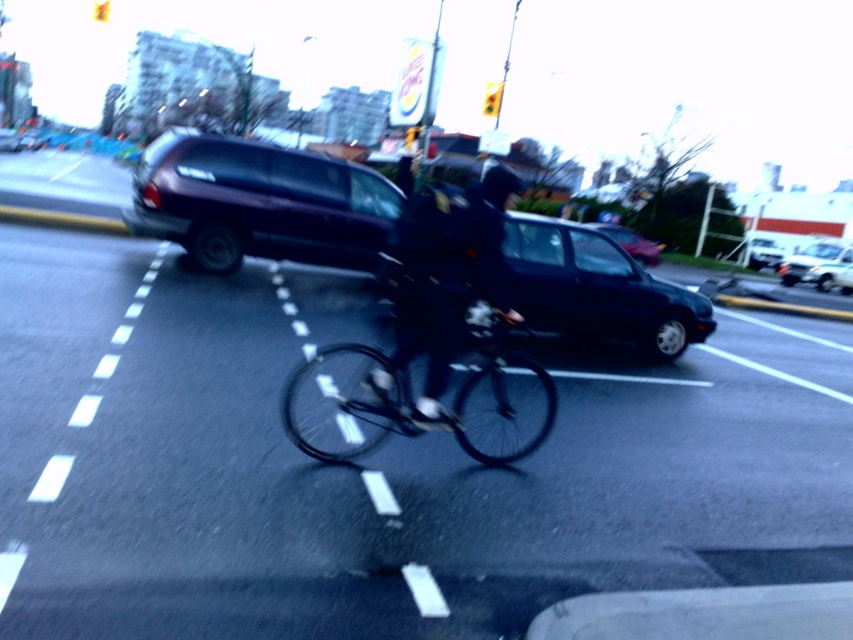
Describe the element at coordinates (259, 202) in the screenshot. This screenshot has height=640, width=853. I see `metallic purple suv at center` at that location.

Is metallic purple suv at center further to camera compared to white glossy suv at center?

No.

Who is more distant from viewer, (587, 282) or (810, 269)?

The point (810, 269) is more distant.

Where is `metallic purple suv at center`? metallic purple suv at center is located at coordinates (259, 202).

Is black rubber bike lane at center to the left of black matte bicycle at center from the viewer's perspective?

Correct, you'll find black rubber bike lane at center to the left of black matte bicycle at center.

Is black rubber bike lane at center thinner than black matte bicycle at center?

In fact, black rubber bike lane at center might be wider than black matte bicycle at center.

Which is in front, point (456, 611) or point (491, 372)?

Point (456, 611) is in front.

In order to click on black rubber bike lane at center in this screenshot , I will do `click(373, 467)`.

Is metallic purple suv at center to the right of black matte helmet at center from the viewer's perspective?

Incorrect, metallic purple suv at center is not on the right side of black matte helmet at center.

Can you confirm if metallic purple suv at center is bigger than black matte helmet at center?

Incorrect, metallic purple suv at center is not larger than black matte helmet at center.

Find the location of a particular element. metallic purple suv at center is located at coordinates (259, 202).

What are the coordinates of `metallic purple suv at center` in the screenshot? It's located at coord(259,202).